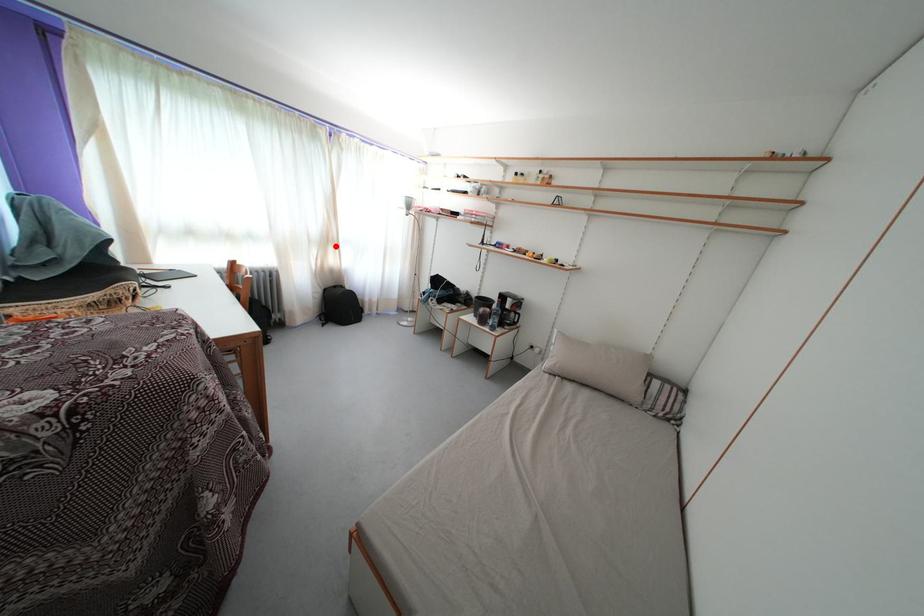
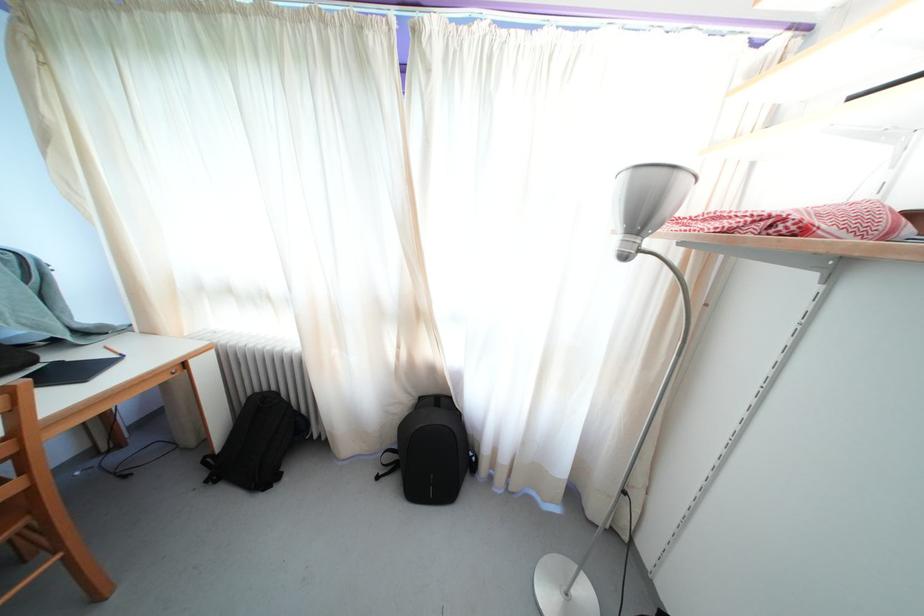
The point at the highlighted location is marked in the first image. Where is the corresponding point in the second image?

(421, 321)